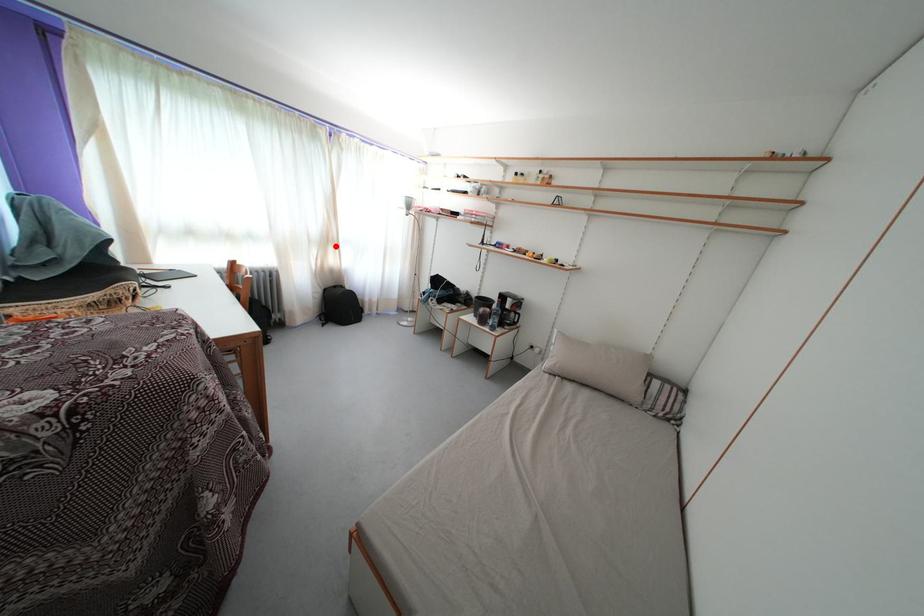
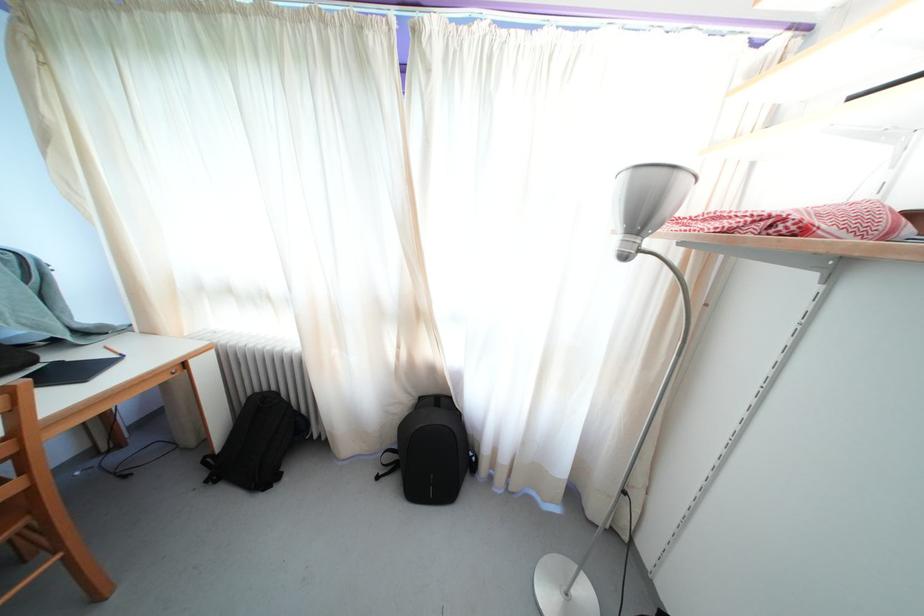
The point at the highlighted location is marked in the first image. Where is the corresponding point in the second image?

(421, 321)